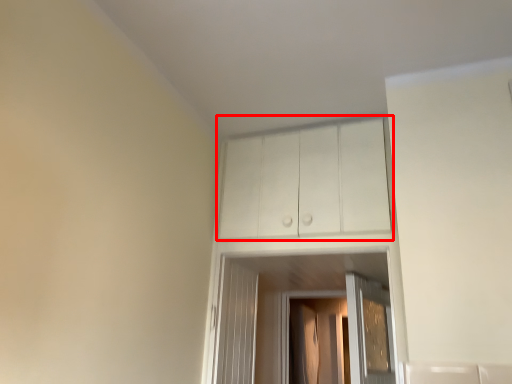
Question: Considering the relative positions of cabinetry (annotated by the red box) and screen door in the image provided, where is cabinetry (annotated by the red box) located with respect to the staircase?

Choices:
 (A) left
 (B) right

Answer: (A)